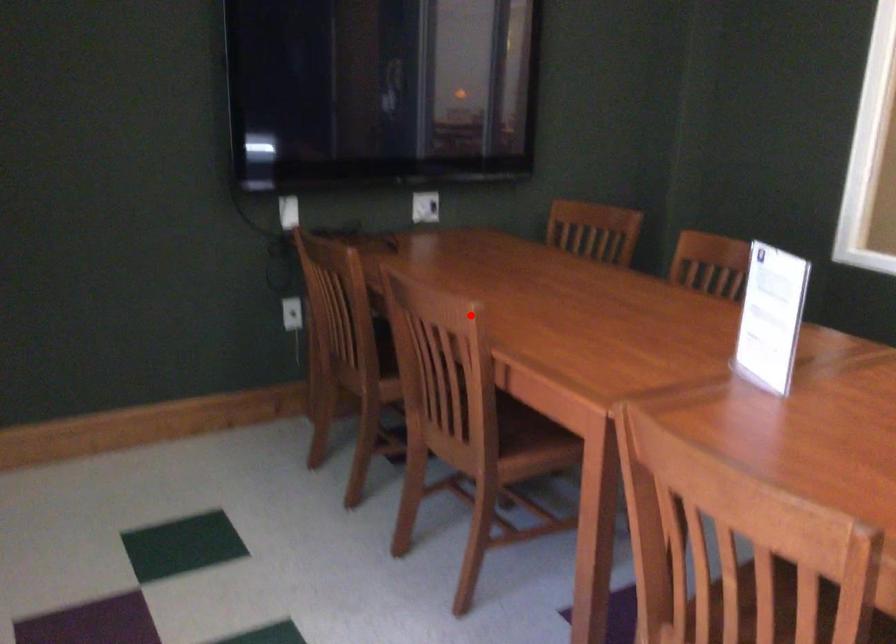
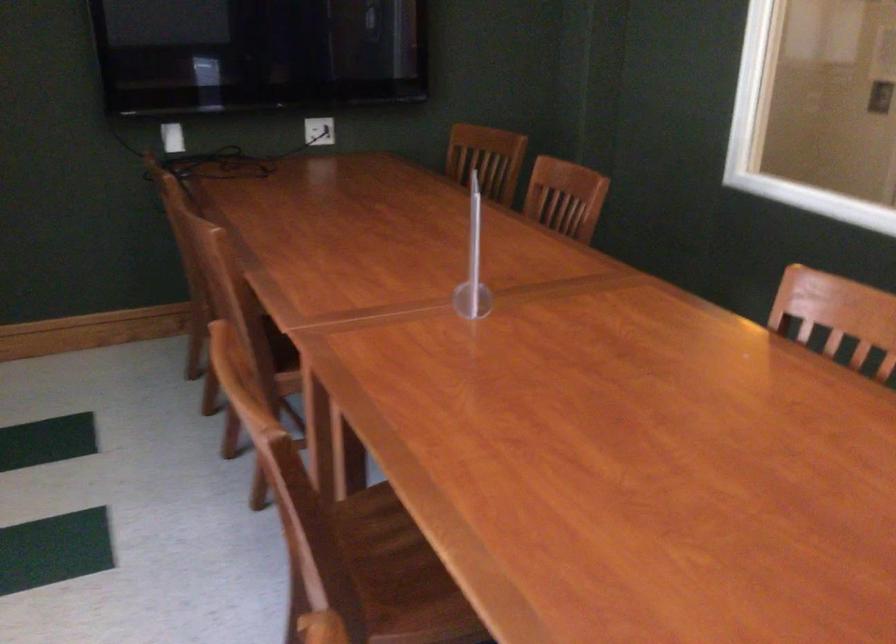
In the second image, find the point that corresponds to the highlighted location in the first image.

(216, 242)